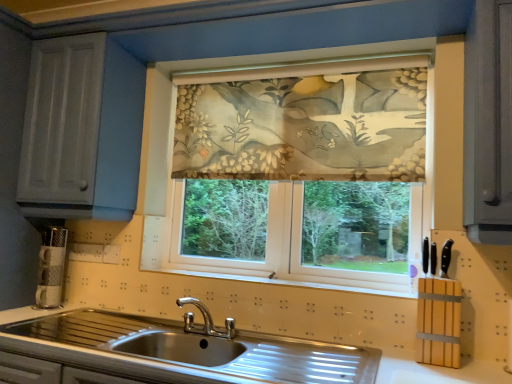
Question: From a real-world perspective, is floral fabric at center below floral fabric curtain at center?

Choices:
 (A) no
 (B) yes

Answer: (B)

Question: Is the position of floral fabric at center more distant than that of floral fabric curtain at center?

Choices:
 (A) no
 (B) yes

Answer: (A)

Question: Is floral fabric at center smaller than floral fabric curtain at center?

Choices:
 (A) yes
 (B) no

Answer: (B)

Question: Is floral fabric at center thinner than floral fabric curtain at center?

Choices:
 (A) no
 (B) yes

Answer: (A)

Question: From the image's perspective, is floral fabric at center beneath floral fabric curtain at center?

Choices:
 (A) no
 (B) yes

Answer: (B)

Question: Considering the positions of floral fabric curtain at center and stainless steel sink at lower center in the image, is floral fabric curtain at center wider or thinner than stainless steel sink at lower center?

Choices:
 (A) thin
 (B) wide

Answer: (A)

Question: Which is correct: floral fabric curtain at center is inside stainless steel sink at lower center, or outside of it?

Choices:
 (A) outside
 (B) inside

Answer: (A)

Question: From a real-world perspective, is floral fabric curtain at center physically located above or below stainless steel sink at lower center?

Choices:
 (A) above
 (B) below

Answer: (A)

Question: Would you say floral fabric curtain at center is to the left or to the right of stainless steel sink at lower center in the picture?

Choices:
 (A) left
 (B) right

Answer: (B)

Question: Would you say floral fabric at center is to the left or to the right of stainless steel sink at lower center in the picture?

Choices:
 (A) left
 (B) right

Answer: (B)

Question: Is point (327, 162) closer or farther from the camera than point (317, 355)?

Choices:
 (A) closer
 (B) farther

Answer: (B)

Question: Do you think floral fabric at center is within stainless steel sink at lower center, or outside of it?

Choices:
 (A) inside
 (B) outside

Answer: (B)

Question: Considering the positions of floral fabric at center and stainless steel sink at lower center in the image, is floral fabric at center wider or thinner than stainless steel sink at lower center?

Choices:
 (A) thin
 (B) wide

Answer: (A)

Question: Looking at the image, does stainless steel sink at lower center seem bigger or smaller compared to floral fabric curtain at center?

Choices:
 (A) big
 (B) small

Answer: (A)

Question: In the image, is stainless steel sink at lower center on the left side or the right side of floral fabric curtain at center?

Choices:
 (A) left
 (B) right

Answer: (A)